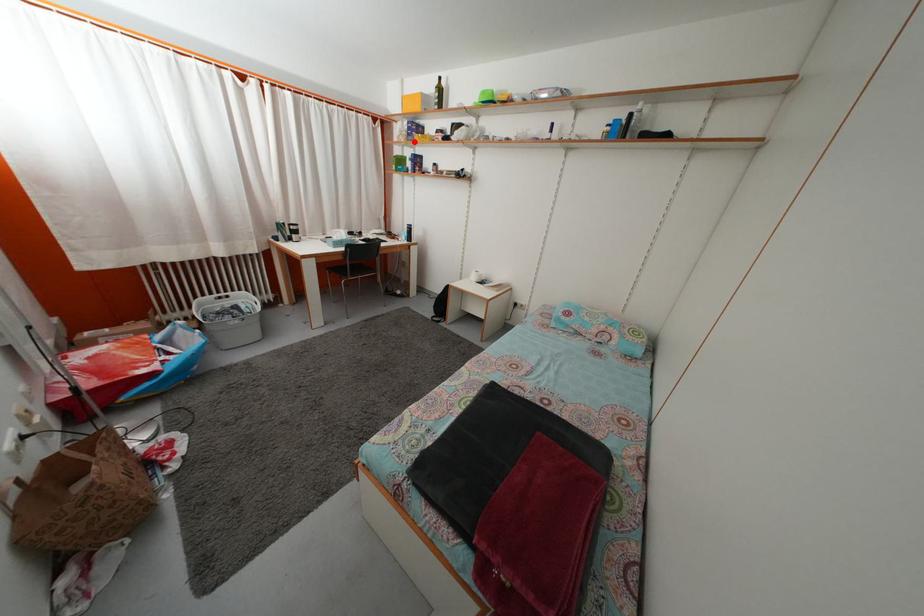
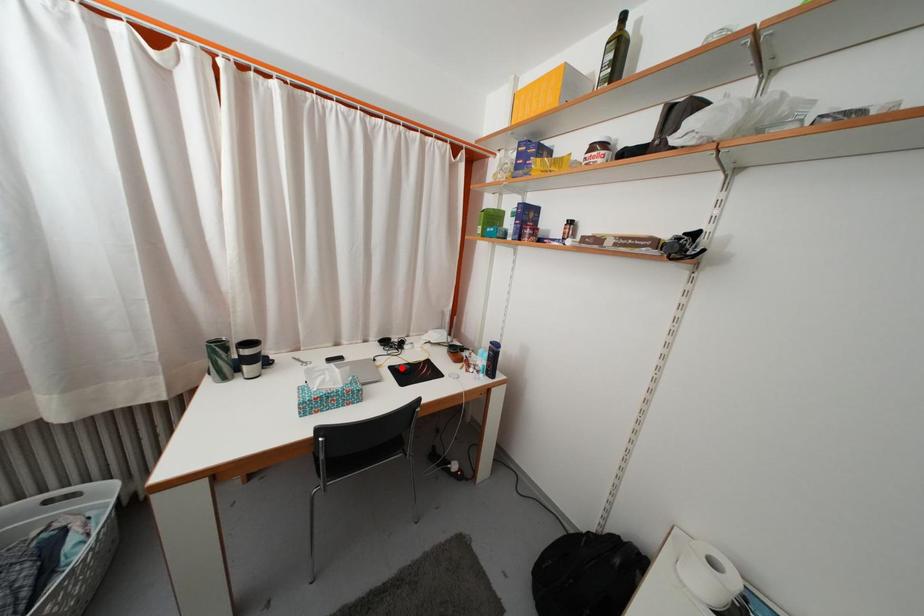
I am providing you with two images of the same scene from different viewpoints. A red point is marked on the first image and another point is marked on the second image. Are the points marked in image1 and image2 representing the same 3D position?

No